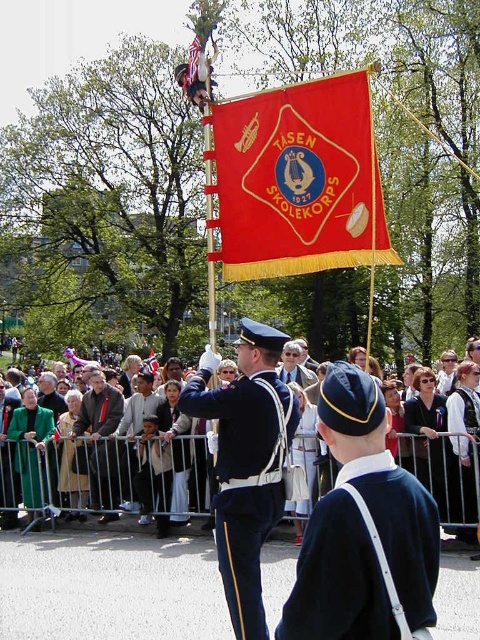
You are at a parade and see two people in different uniforms. The first person is wearing a green fabric coat at left and the second is wearing a black fabric uniform at center. From your perspective, which uniform is positioned to the left?

The green fabric coat at left is positioned to the left of the black fabric uniform at center.